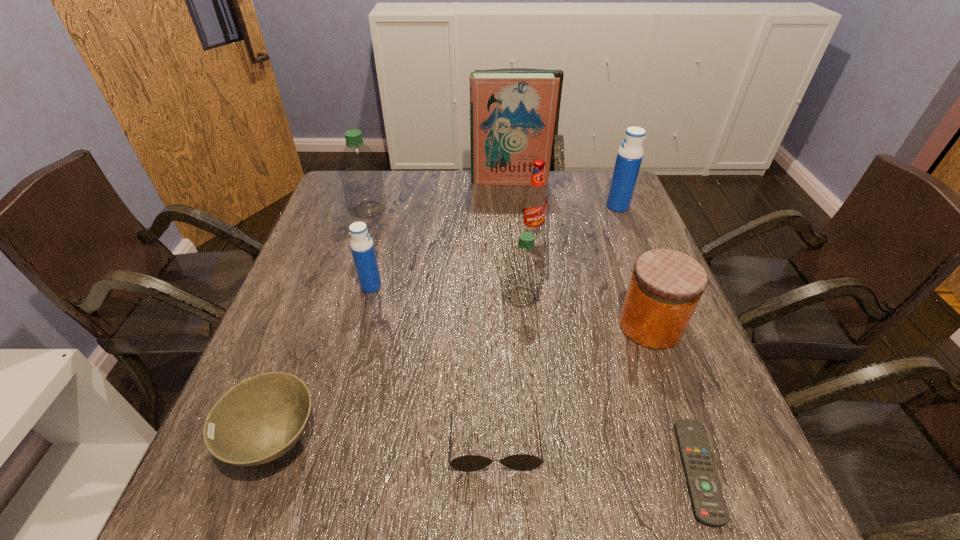
Where is `remote control that is positioned at the near edge`? Image resolution: width=960 pixels, height=540 pixels. remote control that is positioned at the near edge is located at coordinates (709, 507).

Locate an element on the screen. This screenshot has height=540, width=960. water bottle that is at the left edge is located at coordinates point(360,172).

Locate an element on the screen. The width and height of the screenshot is (960, 540). bowl located in the left edge section of the desktop is located at coordinates (262, 418).

Where is `water bottle at the right edge`? Image resolution: width=960 pixels, height=540 pixels. water bottle at the right edge is located at coordinates (629, 157).

Locate an element on the screen. The width and height of the screenshot is (960, 540). jar that is at the right edge is located at coordinates (666, 285).

This screenshot has height=540, width=960. Identify the location of remote control at the right edge. (709, 507).

Locate an element on the screen. object that is positioned at the far left corner is located at coordinates (360, 172).

Find the location of a particular element. The image size is (960, 540). object positioned at the near left corner is located at coordinates (262, 418).

The height and width of the screenshot is (540, 960). I want to click on object that is at the far right corner, so click(629, 157).

Where is `object present at the near right corner`? The width and height of the screenshot is (960, 540). object present at the near right corner is located at coordinates (709, 507).